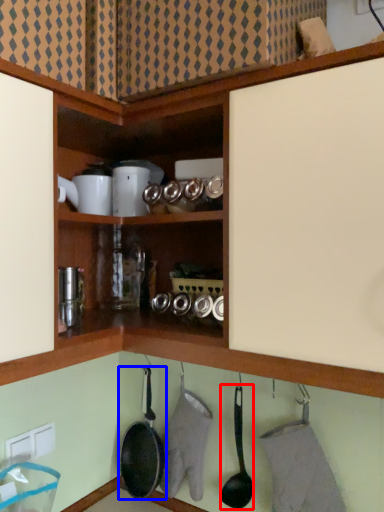
Question: Which object appears closest to the camera in this image, frying pan (highlighted by a red box) or frying pan (highlighted by a blue box)?

Choices:
 (A) frying pan
 (B) frying pan

Answer: (A)